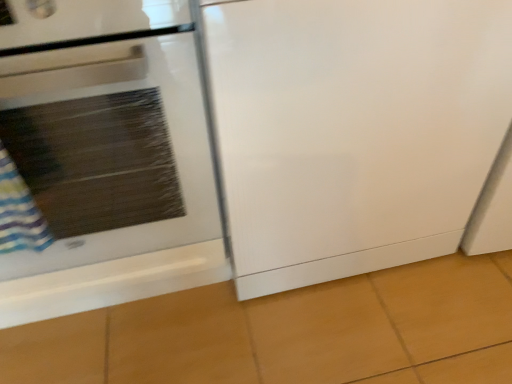
Question: Is white glossy refrigerator at center wider or thinner than white glossy oven at left?

Choices:
 (A) thin
 (B) wide

Answer: (B)

Question: Is white glossy refrigerator at center to the left or to the right of white glossy oven at left in the image?

Choices:
 (A) left
 (B) right

Answer: (B)

Question: From their relative heights in the image, would you say white glossy refrigerator at center is taller or shorter than white glossy oven at left?

Choices:
 (A) short
 (B) tall

Answer: (A)

Question: From the image's perspective, is white glossy oven at left located above or below white glossy refrigerator at center?

Choices:
 (A) above
 (B) below

Answer: (B)

Question: Is white glossy oven at left bigger or smaller than white glossy refrigerator at center?

Choices:
 (A) small
 (B) big

Answer: (B)

Question: Is white glossy oven at left inside the boundaries of white glossy refrigerator at center, or outside?

Choices:
 (A) outside
 (B) inside

Answer: (A)

Question: From a real-world perspective, relative to white glossy refrigerator at center, is white glossy oven at left vertically above or below?

Choices:
 (A) below
 (B) above

Answer: (B)